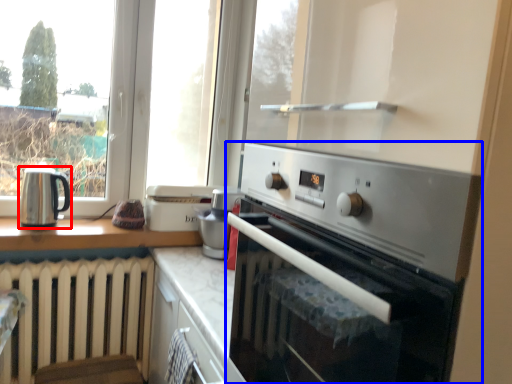
Question: Which point is further to the camera, kitchen appliance (highlighted by a red box) or home appliance (highlighted by a blue box)?

Choices:
 (A) kitchen appliance
 (B) home appliance

Answer: (A)